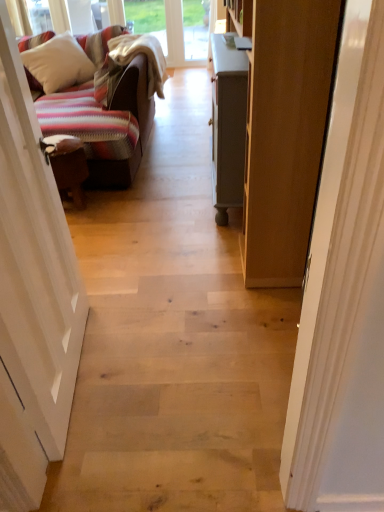
Question: Visually, is white wood door at left, the 2th door viewed from the right, positioned to the left or to the right of white painted wood door at right, arranged as the 2th door when viewed from the left?

Choices:
 (A) left
 (B) right

Answer: (A)

Question: Is white wood door at left, the 1th door viewed from the left, bigger or smaller than white painted wood door at right, the first door from the right?

Choices:
 (A) small
 (B) big

Answer: (B)

Question: Estimate the real-world distances between objects in this image. Which object is closer to the white soft pillow at upper left?

Choices:
 (A) white painted wood door at right, the first door from the right
 (B) white wood door at left, the 2th door viewed from the right

Answer: (B)

Question: Which object is positioned closest to the white soft pillow at upper left?

Choices:
 (A) white painted wood door at right, the first door from the right
 (B) white wood door at left, the 2th door viewed from the right

Answer: (B)